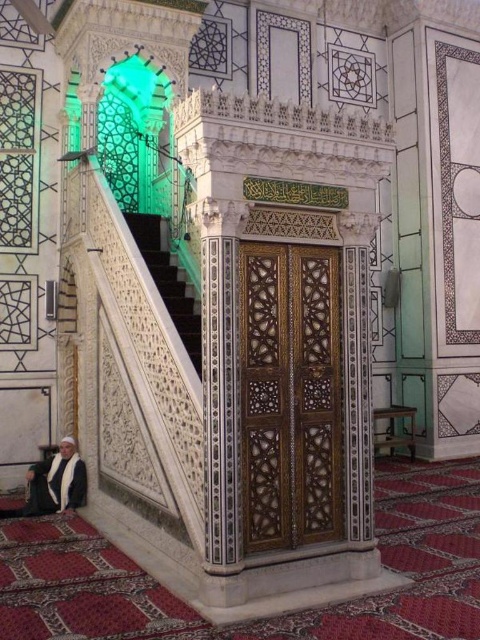
You are standing at the bottom of the white carved wood stairs at center and want to greet the white fabric person at lower left who is 5 feet tall. Can you see the top of their head from your current position?

The white carved wood stairs at center is 5.84 feet away from the white fabric person at lower left. Since the distance is greater than the person height of 5 feet, you cannot see the top of their head from your current position.

You are standing at the entrance of the mosque and see the white carved wood stairs at center and the white fabric person at lower left. Which object is positioned to the right of the other?

The white carved wood stairs at center is to the right of the white fabric person at lower left.